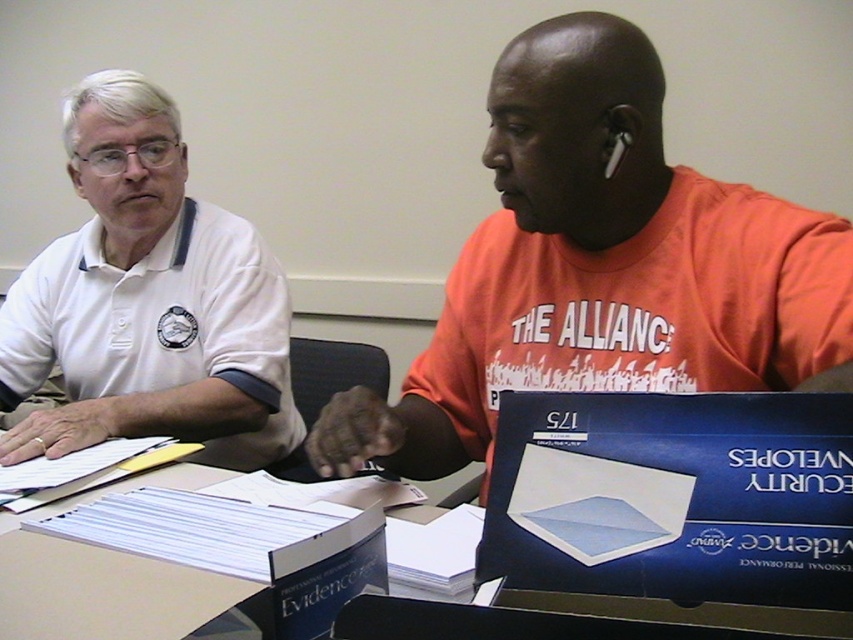
Does orange t-shirt at center have a smaller size compared to white matte shirt at left?

Yes, orange t-shirt at center is smaller than white matte shirt at left.

Which is in front, point (761, 212) or point (215, 448)?

Positioned in front is point (761, 212).

Which is in front, point (709, 369) or point (148, 396)?

Point (709, 369)

Identify the location of orange t-shirt at center. (601, 266).